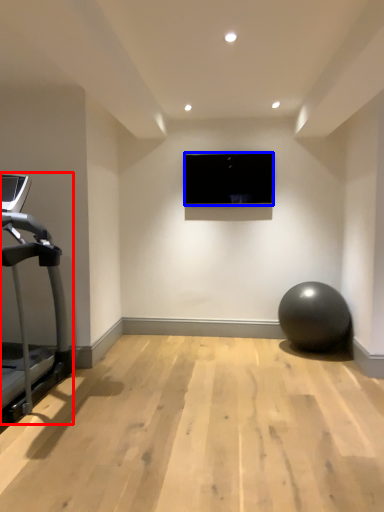
Question: Which point is further to the camera, treadmill (highlighted by a red box) or computer screen (highlighted by a blue box)?

Choices:
 (A) treadmill
 (B) computer screen

Answer: (B)